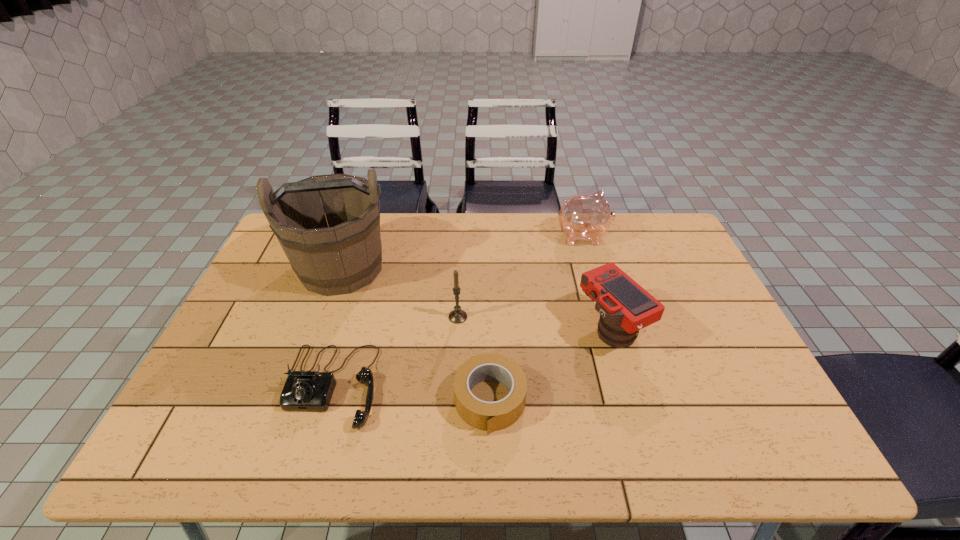
The width and height of the screenshot is (960, 540). Identify the location of vacant space situated on the dial of the telephone. (311, 456).

Identify the location of bucket that is at the far edge. (330, 257).

The height and width of the screenshot is (540, 960). In order to click on piggy bank present at the far edge in this screenshot , I will do `click(587, 217)`.

The image size is (960, 540). In order to click on telephone positioned at the near edge in this screenshot , I will do `click(310, 390)`.

I want to click on duct tape that is at the near edge, so click(488, 416).

Identify the location of object positioned at the left edge. (330, 257).

Find the location of `object located at the far left corner`. object located at the far left corner is located at coordinates (330, 257).

Where is `free location at the far edge`? The width and height of the screenshot is (960, 540). free location at the far edge is located at coordinates (475, 222).

Where is `vacant space at the near edge of the desktop`? The image size is (960, 540). vacant space at the near edge of the desktop is located at coordinates (417, 446).

In the image, there is a desktop. At what (x,y) coordinates should I click in order to perform the action: click on vacant space at the left edge. Please return your answer as a coordinate pair (x, y). Looking at the image, I should click on (207, 403).